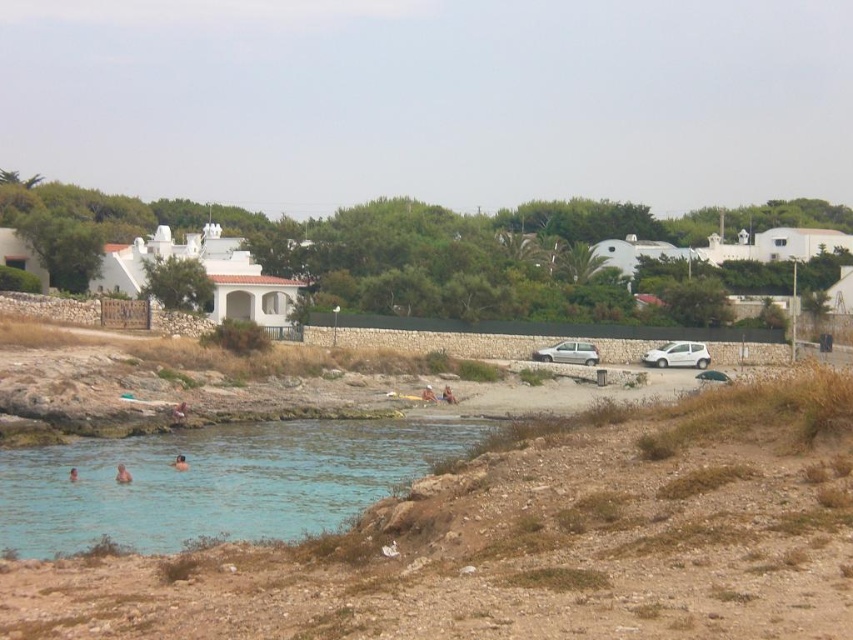
Question: Which point is closer to the camera?

Choices:
 (A) satin silver van at center
 (B) light brown wooden surfboard at center
 (C) skinny person at lower left
 (D) white matte van at right

Answer: (C)

Question: Which object appears farthest from the camera in this image?

Choices:
 (A) skinny person at lower left
 (B) clear blue water at lower left
 (C) white matte van at right

Answer: (C)

Question: Observing the image, what is the correct spatial positioning of clear blue water at lower left in reference to smooth skin person at lower left?

Choices:
 (A) right
 (B) left

Answer: (A)

Question: Does satin silver van at center appear on the right side of pink skin at lower left?

Choices:
 (A) yes
 (B) no

Answer: (A)

Question: Which point appears closest to the camera in this image?

Choices:
 (A) (74, 474)
 (B) (424, 390)

Answer: (A)

Question: In this image, where is white matte van at right located relative to smooth skin person at lower left?

Choices:
 (A) left
 (B) right

Answer: (B)